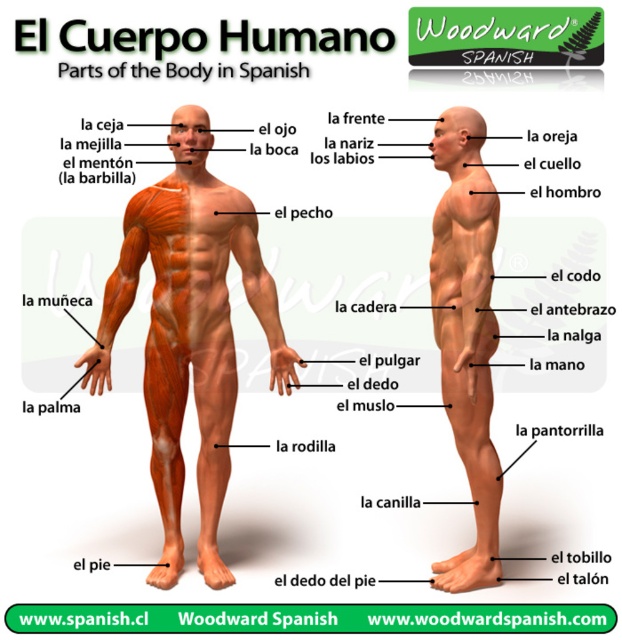
Question: Among these points, which one is farthest from the camera?

Choices:
 (A) (442, 305)
 (B) (159, 289)

Answer: (B)

Question: Is matte orange muscle at center closer to the viewer compared to matte orange muscle at right?

Choices:
 (A) yes
 (B) no

Answer: (B)

Question: Does matte orange muscle at center appear under matte orange muscle at right?

Choices:
 (A) yes
 (B) no

Answer: (B)

Question: Is matte orange muscle at center thinner than matte orange muscle at right?

Choices:
 (A) yes
 (B) no

Answer: (B)

Question: Which point appears farthest from the camera in this image?

Choices:
 (A) coord(470,564)
 (B) coord(165,307)

Answer: (B)